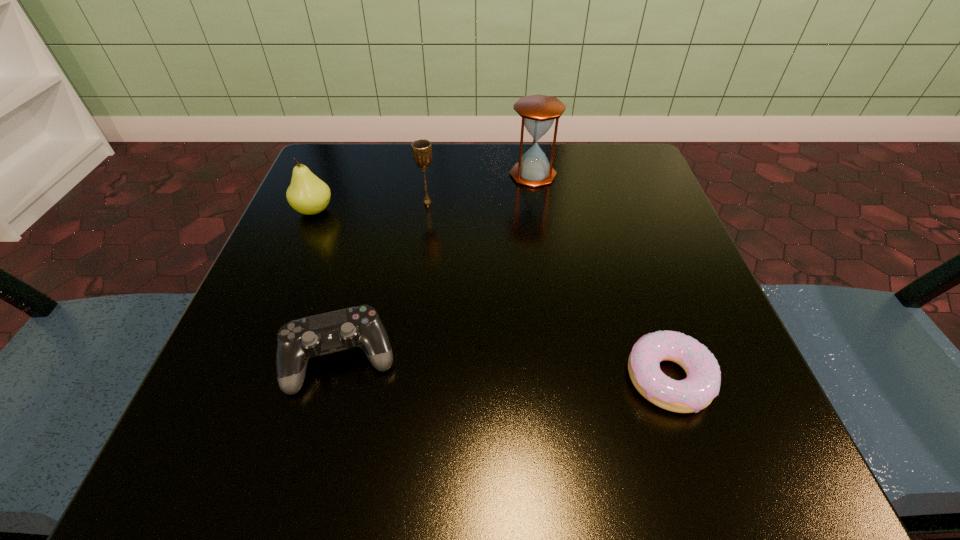
Where is `free space that satisfies the following two spatial constraints: 1. on the front side of the rightmost object; 2. on the left side of the farthest object`? Image resolution: width=960 pixels, height=540 pixels. free space that satisfies the following two spatial constraints: 1. on the front side of the rightmost object; 2. on the left side of the farthest object is located at coordinates (564, 379).